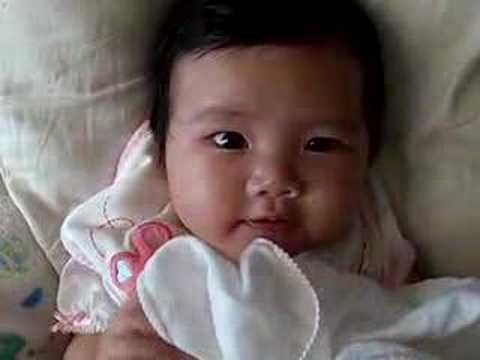
What are the coordinates of `pillow` in the screenshot? It's located at (40, 69).